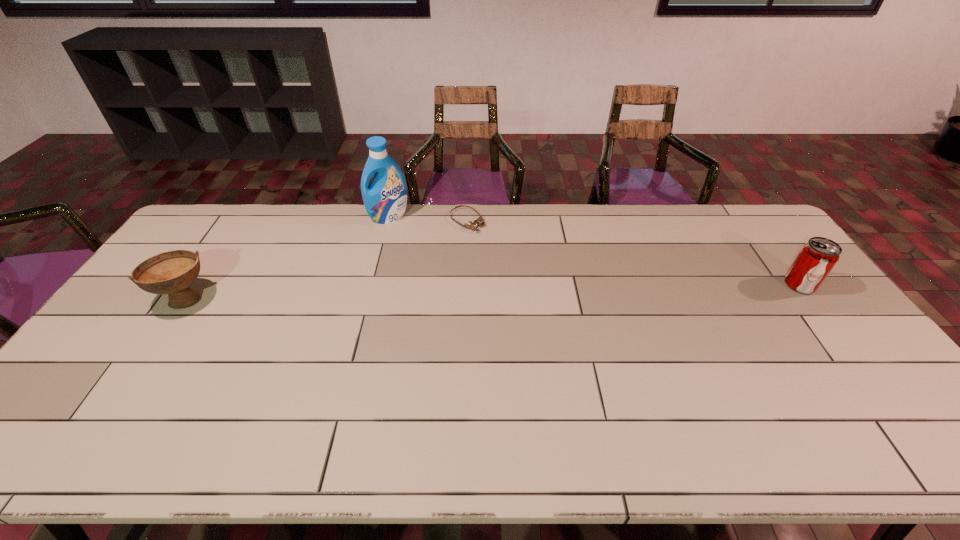
Identify the location of empty location between the detergent and the third object from left to right. The image size is (960, 540). (428, 219).

You are a GUI agent. You are given a task and a screenshot of the screen. Output one action in this format:
    pyautogui.click(x=<x>, y=<y>)
    Task: Click on the free space between the second object from left to right and the pop soda
    The height and width of the screenshot is (540, 960).
    Given the screenshot: What is the action you would take?
    pyautogui.click(x=594, y=251)

Where is `blank region between the second object from left to right and the rightmost object`? The height and width of the screenshot is (540, 960). blank region between the second object from left to right and the rightmost object is located at coordinates (594, 251).

Identify which object is the nearest to the pop soda. Please provide its 2D coordinates. Your answer should be formatted as a tuple, i.e. [(x, y)], where the tuple contains the x and y coordinates of a point satisfying the conditions above.

[(471, 225)]

Find the location of a particular element. The height and width of the screenshot is (540, 960). object that is the third closest to the leftmost object is located at coordinates (817, 257).

The height and width of the screenshot is (540, 960). I want to click on free spot that satisfies the following two spatial constraints: 1. on the back side of the leftmost object; 2. on the right side of the rightmost object, so click(195, 285).